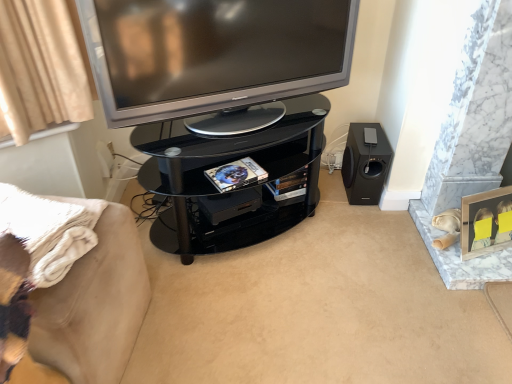
Question: From a real-world perspective, is black glass tv cabinet at center above or below silver metallic television at upper center?

Choices:
 (A) above
 (B) below

Answer: (B)

Question: Considering their positions, is black glass tv cabinet at center located in front of or behind silver metallic television at upper center?

Choices:
 (A) behind
 (B) front

Answer: (A)

Question: Which is farther from the silver metallic television at upper center?

Choices:
 (A) beige fabric couch at lower left
 (B) black glass tv cabinet at center
 (C) black matte speaker at lower right

Answer: (C)

Question: Based on their relative distances, which object is farther from the silver metallic television at upper center?

Choices:
 (A) black glass tv cabinet at center
 (B) beige fabric couch at lower left
 (C) black matte speaker at lower right

Answer: (C)